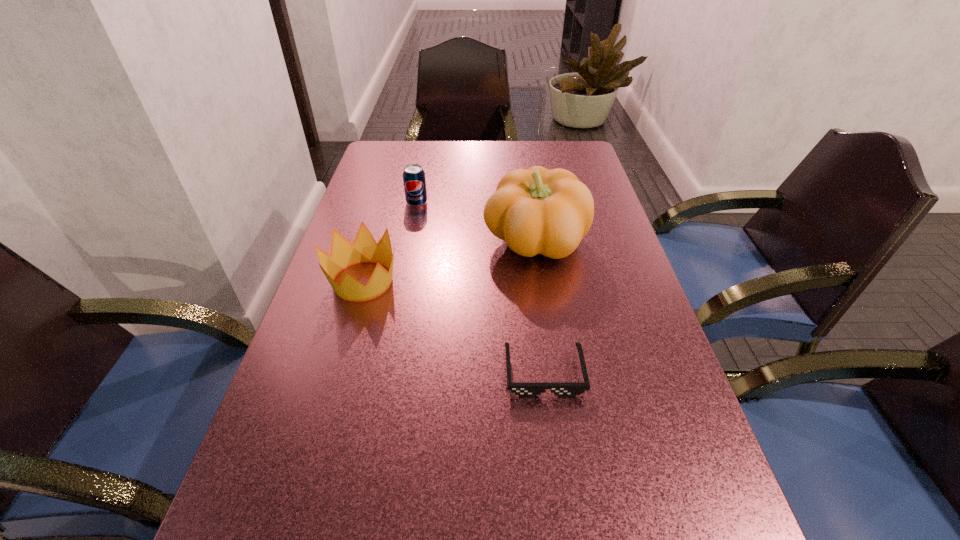
This screenshot has width=960, height=540. I want to click on crown at the left edge, so click(364, 248).

You are a GUI agent. You are given a task and a screenshot of the screen. Output one action in this format:
    pyautogui.click(x=<x>, y=<y>)
    Task: Click on the object that is at the right edge
    
    Given the screenshot: What is the action you would take?
    pyautogui.click(x=536, y=211)

In the image, there is a desktop. At what (x,y) coordinates should I click in order to perform the action: click on vacant area at the far edge. Please return your answer as a coordinate pair (x, y). Image resolution: width=960 pixels, height=540 pixels. Looking at the image, I should click on (455, 172).

Identify the location of vacant region at the left edge of the desktop. (289, 394).

This screenshot has height=540, width=960. I want to click on free location at the right edge, so click(622, 367).

The width and height of the screenshot is (960, 540). I want to click on free space at the far left corner of the desktop, so click(x=393, y=148).

Identify the location of free point at the far right corner. (574, 164).

You are a GUI agent. You are given a task and a screenshot of the screen. Output one action in this format:
    pyautogui.click(x=<x>, y=<y>)
    Task: Click on the free spot between the crown and the shortest object
    The height and width of the screenshot is (540, 960).
    Given the screenshot: What is the action you would take?
    pyautogui.click(x=453, y=327)

Identify the location of vacant area between the farthest object and the pumpkin. [x=476, y=222].

Locate an element on the screen. vacant region between the farthest object and the tallest object is located at coordinates (476, 222).